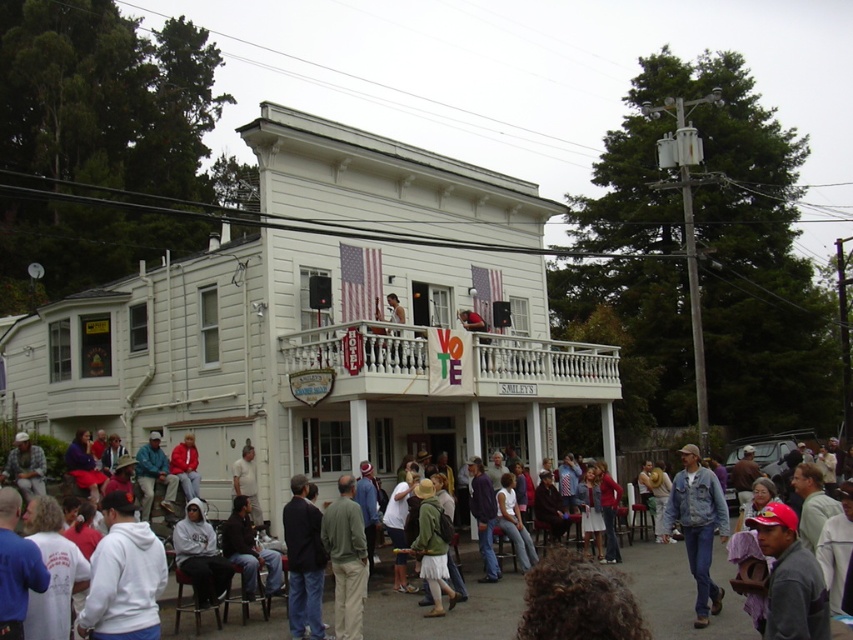
Which is in front, point (486, 340) or point (393, 593)?

Point (393, 593) is more forward.

Between white painted wood at upper center and denim jacket at center, which one appears on the left side from the viewer's perspective?

white painted wood at upper center is more to the left.

Is point (364, 374) more distant than point (714, 628)?

Yes.

Locate an element on the screen. Image resolution: width=853 pixels, height=640 pixels. white painted wood at upper center is located at coordinates (451, 364).

Can you confirm if denim jacket at center is wider than green fabric jacket at center?

Yes, denim jacket at center is wider than green fabric jacket at center.

Does denim jacket at center appear under green fabric jacket at center?

Correct, denim jacket at center is located below green fabric jacket at center.

Where is `denim jacket at center`? denim jacket at center is located at coordinates (682, 593).

In the scene shown: Can you confirm if denim jacket at lower right is shorter than white hoodie at lower left?

No.

Is denim jacket at lower right below white hoodie at lower left?

Yes.

Find the location of a particular element. The image size is (853, 640). denim jacket at lower right is located at coordinates (697, 525).